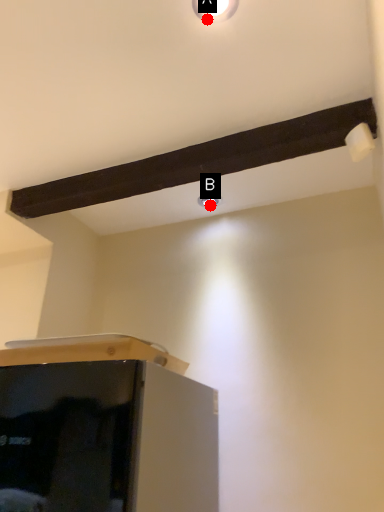
Question: Two points are circled on the image, labeled by A and B beside each circle. Which point is closer to the camera taking this photo?

Choices:
 (A) A is closer
 (B) B is closer

Answer: (A)